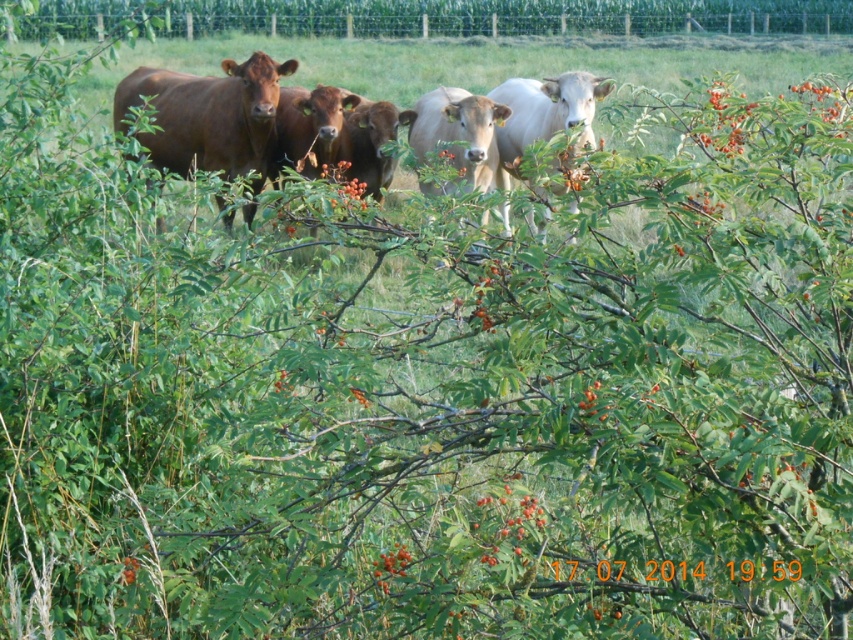
Question: Which object is positioned closest to the white glossy bull at center?

Choices:
 (A) matte brown cow at center
 (B) brown glossy cows at center

Answer: (B)

Question: Which of the following is the closest to the observer?

Choices:
 (A) white glossy bull at center
 (B) matte brown cow at center

Answer: (A)

Question: Is matte brown cow at center bigger than white glossy bull at center?

Choices:
 (A) yes
 (B) no

Answer: (A)

Question: Which object is positioned farthest from the white glossy bull at center?

Choices:
 (A) matte brown cow at center
 (B) brown glossy cows at center

Answer: (A)

Question: Can you confirm if brown glossy cows at center is wider than white glossy bull at center?

Choices:
 (A) no
 (B) yes

Answer: (B)

Question: Considering the relative positions of matte brown cow at center and white glossy bull at center in the image provided, where is matte brown cow at center located with respect to white glossy bull at center?

Choices:
 (A) right
 (B) left

Answer: (B)